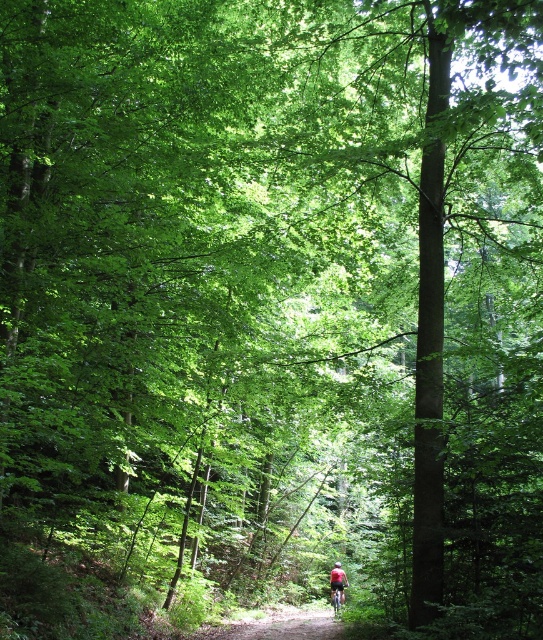
You are a hiker standing on the dirt path at center and want to reach the red fabric cyclist at center. Which direction should you move to get closer to the cyclist?

The dirt path at center is positioned on the left side of the red fabric cyclist at center, so you should move to the right to get closer to the cyclist.

You are a hiker planning to walk along the forest path. You see both the red fabric mountain biker at center and the red fabric cyclist at center. Which one appears bigger to you?

The red fabric mountain biker at center appears bigger than the red fabric cyclist at center.

You are standing on the dirt trail in the center of the forest and see two points marked in the scene. Which point, point (245, 621) or point (334, 598), is closer to you?

Point (245, 621) is closer to the viewer than point (334, 598).